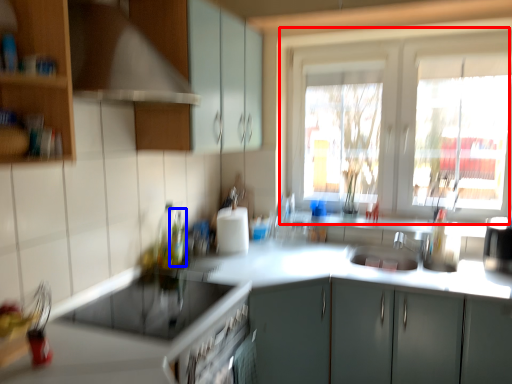
Question: Which of the following is the farthest to the observer, window (highlighted by a red box) or bottle (highlighted by a blue box)?

Choices:
 (A) window
 (B) bottle

Answer: (A)